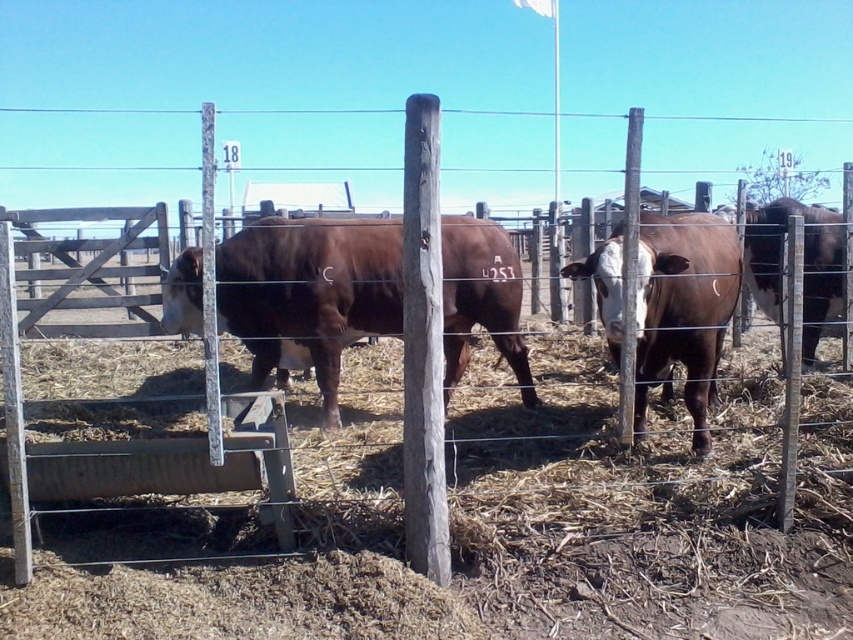
This screenshot has height=640, width=853. In order to click on white-brown textured cow at center in this screenshot , I will do `click(683, 308)`.

Is white-brown textured cow at center further to the viewer compared to white-brown textured bull at center-right?

Result: That is False.

Is point (685, 348) closer to camera compared to point (820, 276)?

Yes, it is in front of point (820, 276).

Where is `white-brown textured cow at center`? The width and height of the screenshot is (853, 640). white-brown textured cow at center is located at coordinates (683, 308).

Is brown smooth cow at center below white-brown textured cow at center?

Correct, brown smooth cow at center is located below white-brown textured cow at center.

Is brown smooth cow at center bigger than white-brown textured cow at center?

No.

Between point (263, 364) and point (704, 397), which one is positioned in front?

Point (704, 397)

Locate an element on the screen. The width and height of the screenshot is (853, 640). brown smooth cow at center is located at coordinates tap(309, 294).

Is brown smooth cow at center to the left of white-brown textured bull at center-right from the viewer's perspective?

Correct, you'll find brown smooth cow at center to the left of white-brown textured bull at center-right.

Does point (329, 378) come farther from viewer compared to point (817, 272)?

No, (329, 378) is closer to viewer.

The width and height of the screenshot is (853, 640). Find the location of `brown smooth cow at center`. brown smooth cow at center is located at coordinates (309, 294).

Locate an element on the screen. Image resolution: width=853 pixels, height=640 pixels. brown smooth cow at center is located at coordinates (309, 294).